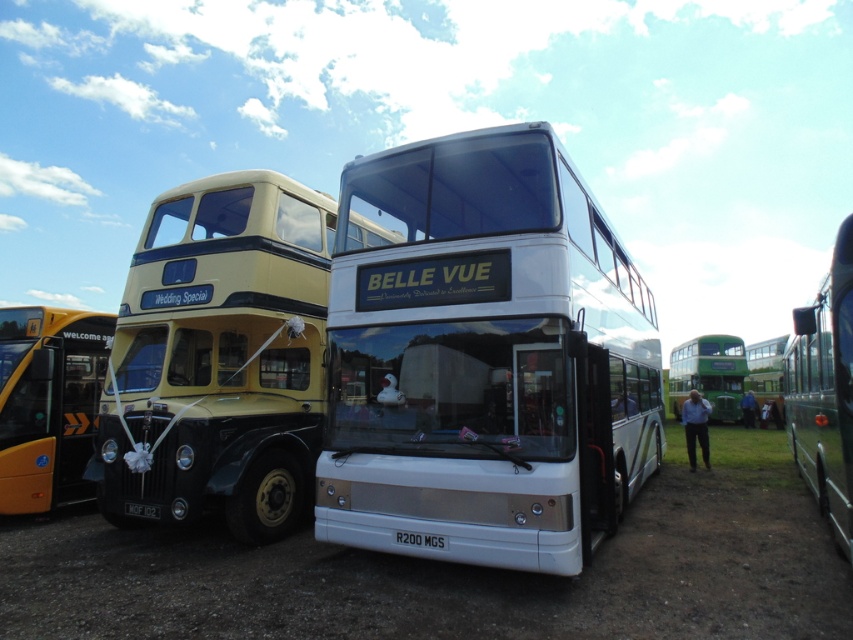
Does white glossy double-decker bus at center have a larger size compared to green metallic bus at right?

Incorrect, white glossy double-decker bus at center is not larger than green metallic bus at right.

Between point (352, 371) and point (814, 324), which one is positioned behind?

Positioned behind is point (352, 371).

Image resolution: width=853 pixels, height=640 pixels. I want to click on white glossy double-decker bus at center, so click(x=485, y=356).

Is yellow matte double-decker bus at left shorter than white plastic license plate at center?

In fact, yellow matte double-decker bus at left may be taller than white plastic license plate at center.

Which is in front, point (204, 212) or point (425, 545)?

Positioned in front is point (425, 545).

Which is behind, point (126, 328) or point (433, 540)?

The point (126, 328) is more distant.

This screenshot has height=640, width=853. In order to click on yellow matte double-decker bus at left in this screenshot , I will do `click(219, 356)`.

Between point (421, 410) and point (422, 538), which one is positioned in front?

Point (422, 538) is in front.

Which is behind, point (392, 552) or point (431, 540)?

Positioned behind is point (392, 552).

Identify the location of white glossy double-decker bus at center. tap(485, 356).